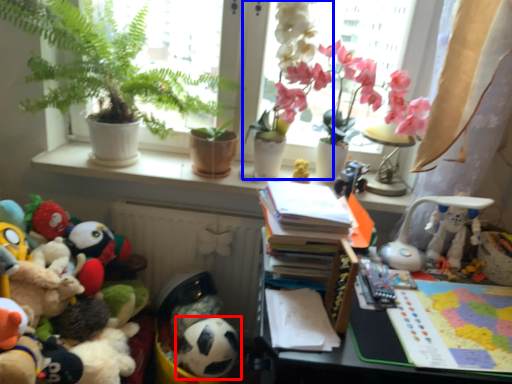
Question: Which point is further to the camera, toy (highlighted by a red box) or houseplant (highlighted by a blue box)?

Choices:
 (A) toy
 (B) houseplant

Answer: (A)